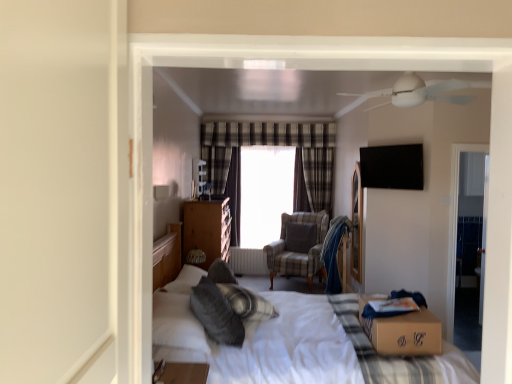
Question: Is the position of transparent glass window screen at center more distant than that of plaid fabric armchair at center?

Choices:
 (A) yes
 (B) no

Answer: (A)

Question: Is transparent glass window screen at center facing towards plaid fabric armchair at center?

Choices:
 (A) no
 (B) yes

Answer: (B)

Question: From a real-world perspective, is transparent glass window screen at center over plaid fabric armchair at center?

Choices:
 (A) no
 (B) yes

Answer: (B)

Question: From the image's perspective, would you say transparent glass window screen at center is shown under plaid fabric armchair at center?

Choices:
 (A) yes
 (B) no

Answer: (B)

Question: Does transparent glass window screen at center have a lesser height compared to plaid fabric armchair at center?

Choices:
 (A) no
 (B) yes

Answer: (A)

Question: Does transparent glass window screen at center have a greater width compared to plaid fabric armchair at center?

Choices:
 (A) yes
 (B) no

Answer: (B)

Question: Does plaid fabric armchair at center appear on the right side of brown cardboard box at center?

Choices:
 (A) no
 (B) yes

Answer: (A)

Question: Could you tell me if plaid fabric armchair at center is turned towards brown cardboard box at center?

Choices:
 (A) yes
 (B) no

Answer: (B)

Question: Is plaid fabric armchair at center facing away from brown cardboard box at center?

Choices:
 (A) yes
 (B) no

Answer: (B)

Question: Considering the relative sizes of plaid fabric armchair at center and brown cardboard box at center in the image provided, is plaid fabric armchair at center thinner than brown cardboard box at center?

Choices:
 (A) no
 (B) yes

Answer: (A)

Question: Does plaid fabric armchair at center have a smaller size compared to brown cardboard box at center?

Choices:
 (A) yes
 (B) no

Answer: (B)

Question: From the image's perspective, is plaid fabric armchair at center on brown cardboard box at center?

Choices:
 (A) no
 (B) yes

Answer: (B)

Question: Is soft gray pillow at center, which appears as the first pillow when viewed from the left, positioned behind white metallic radiator at center?

Choices:
 (A) no
 (B) yes

Answer: (A)